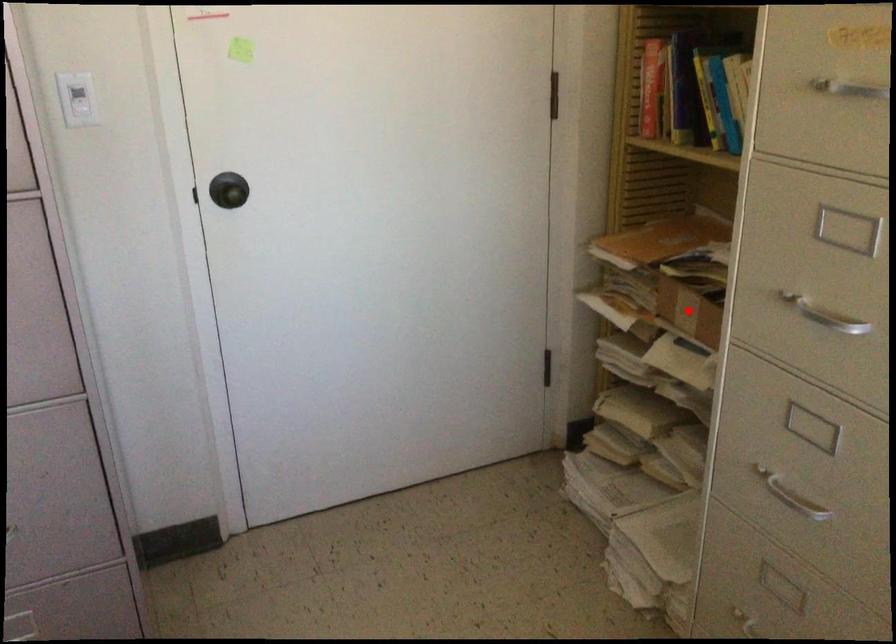
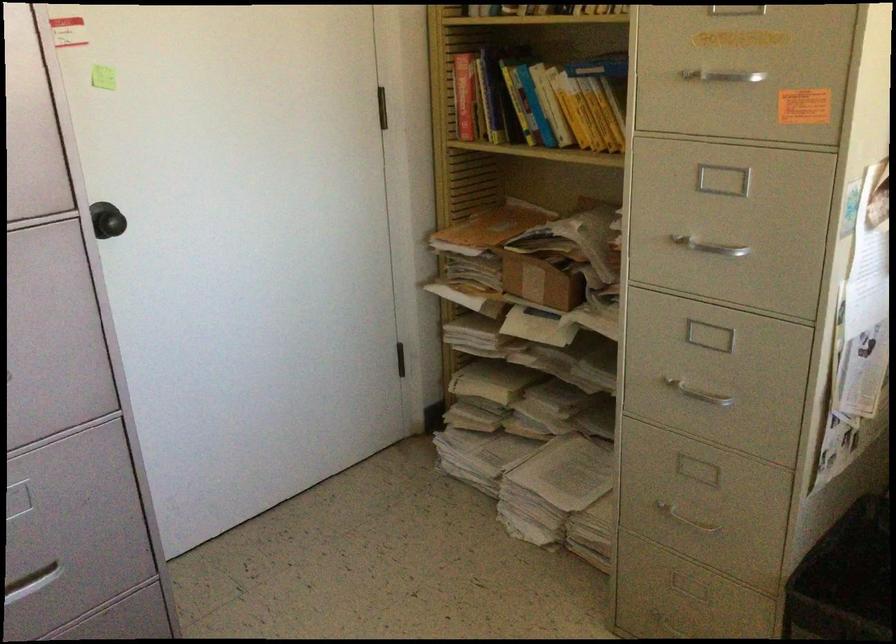
Question: I am providing you with two images of the same scene from different viewpoints. A red point is shown in image1. For the corresponding object point in image2, is it positioned nearer or farther from the camera?

Choices:
 (A) Nearer
 (B) Farther

Answer: (B)